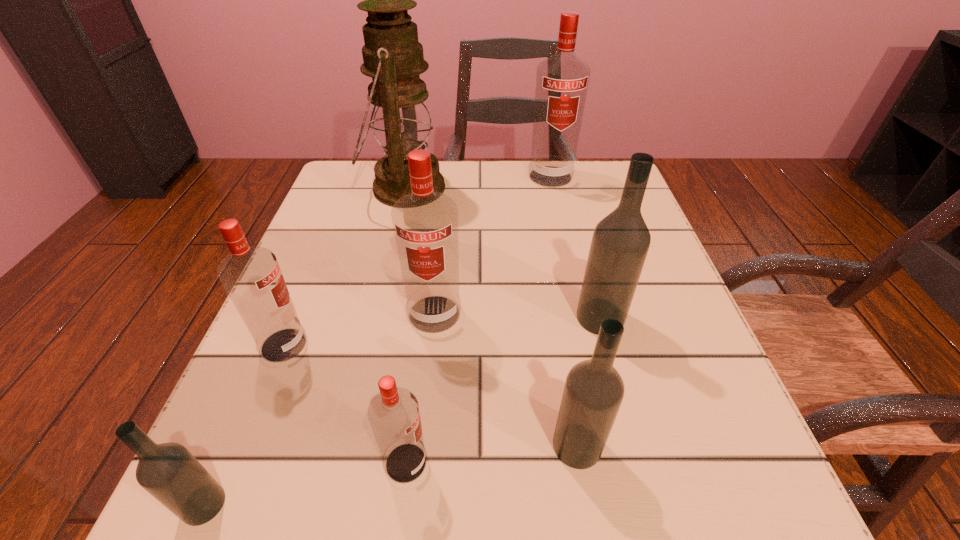
Locate an element on the screen. This screenshot has height=540, width=960. vacant space that satisfies the following two spatial constraints: 1. on the front label of the farthest vodka; 2. on the front label of the third biggest red vodka is located at coordinates (588, 345).

What are the coordinates of `free space that satisfies the following two spatial constraints: 1. on the front label of the rightmost red vodka; 2. on the front label of the nearest red vodka` in the screenshot? It's located at (615, 463).